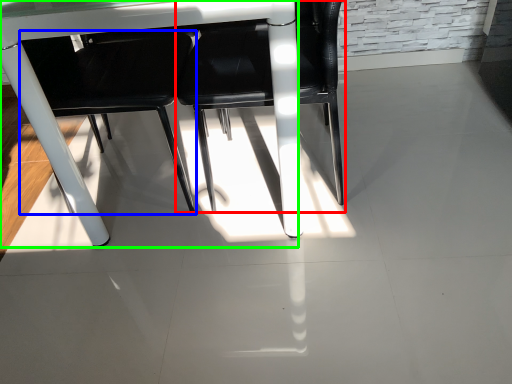
Question: Estimate the real-world distances between objects in this image. Which object is farther from chair (highlighted by a red box), chair (highlighted by a blue box) or table (highlighted by a green box)?

Choices:
 (A) chair
 (B) table

Answer: (B)